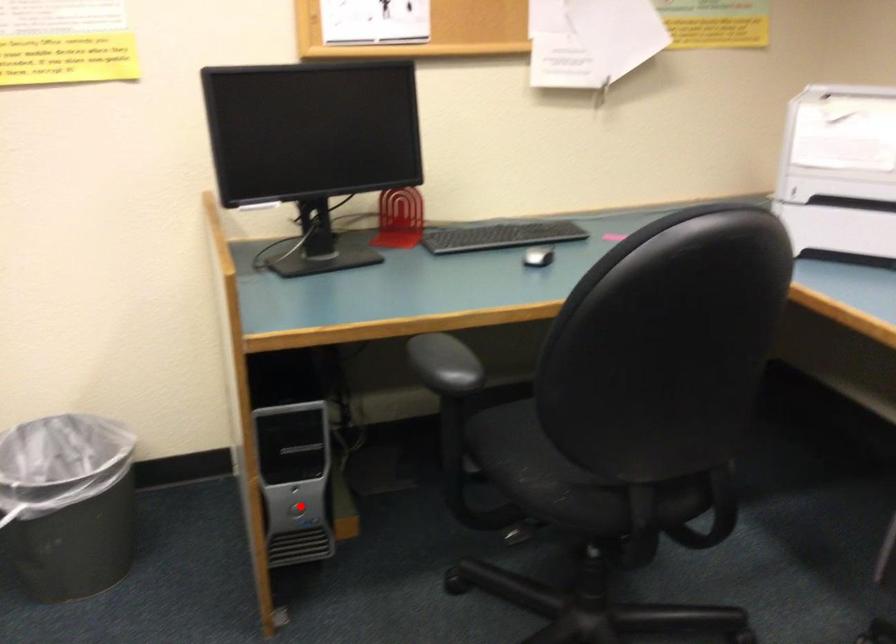
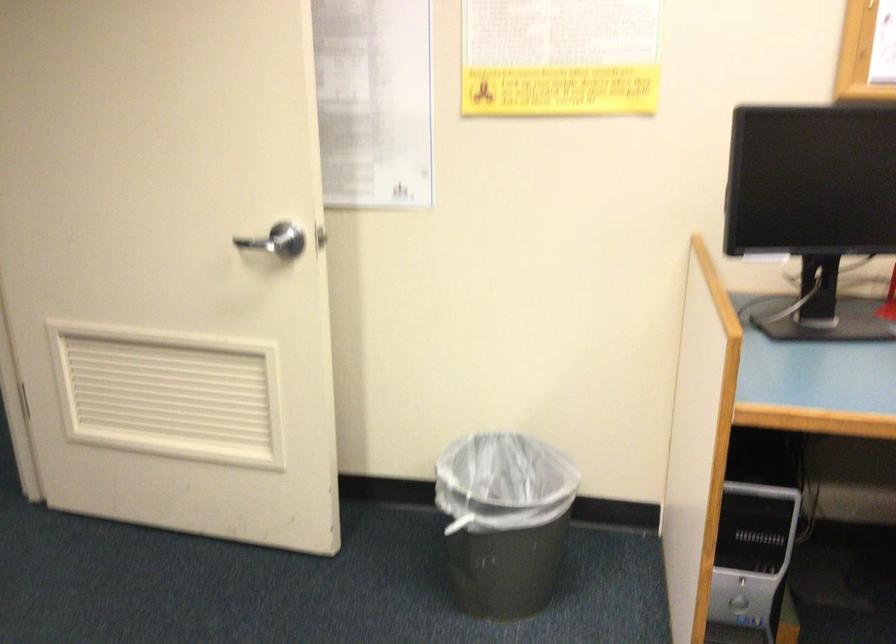
Question: I am providing you with two images of the same scene from different viewpoints. In image1, a red point is highlighted. Considering the same 3D point in image2, which of the following is correct?

Choices:
 (A) It is closer
 (B) It is farther

Answer: (A)